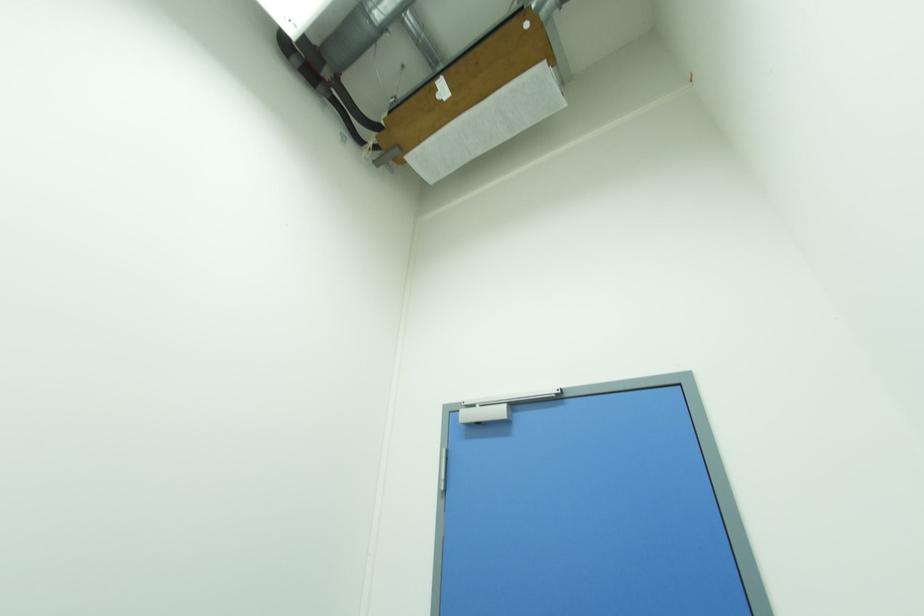
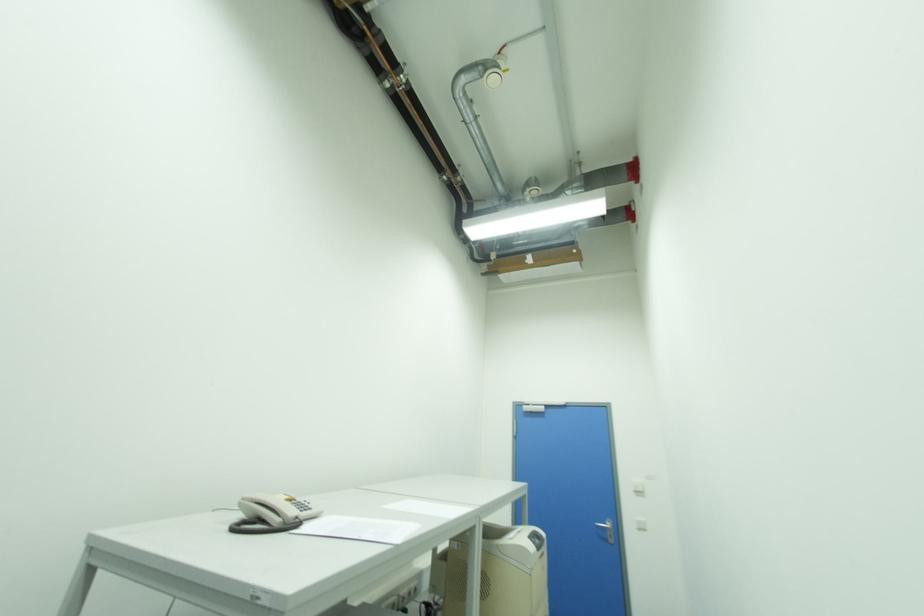
Which direction would the cameraman need to move to produce the second image?

The movement direction of the cameraman is left, backward.